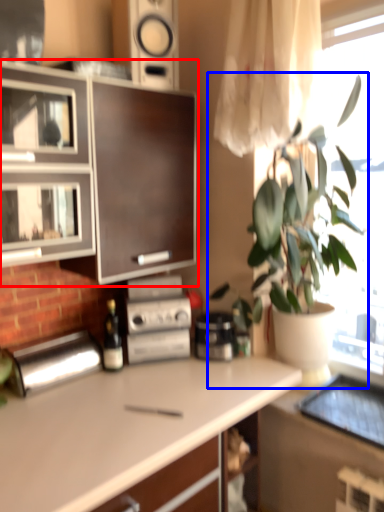
Question: Among these objects, which one is nearest to the camera, cabinetry (highlighted by a red box) or houseplant (highlighted by a blue box)?

Choices:
 (A) cabinetry
 (B) houseplant

Answer: (B)